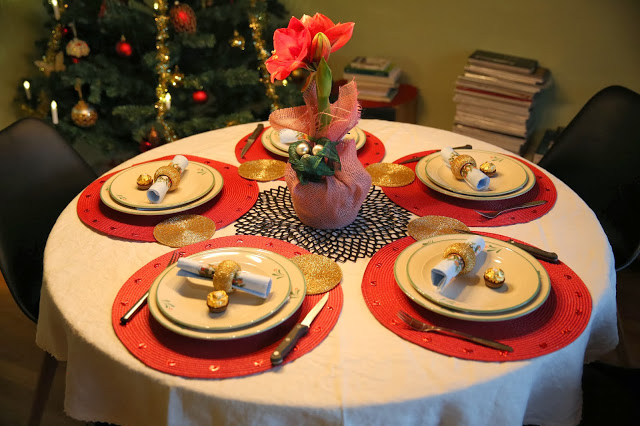
This screenshot has height=426, width=640. What are the coordinates of `round gold mats` in the screenshot? It's located at (319, 272), (180, 229), (259, 170), (395, 174), (422, 225).